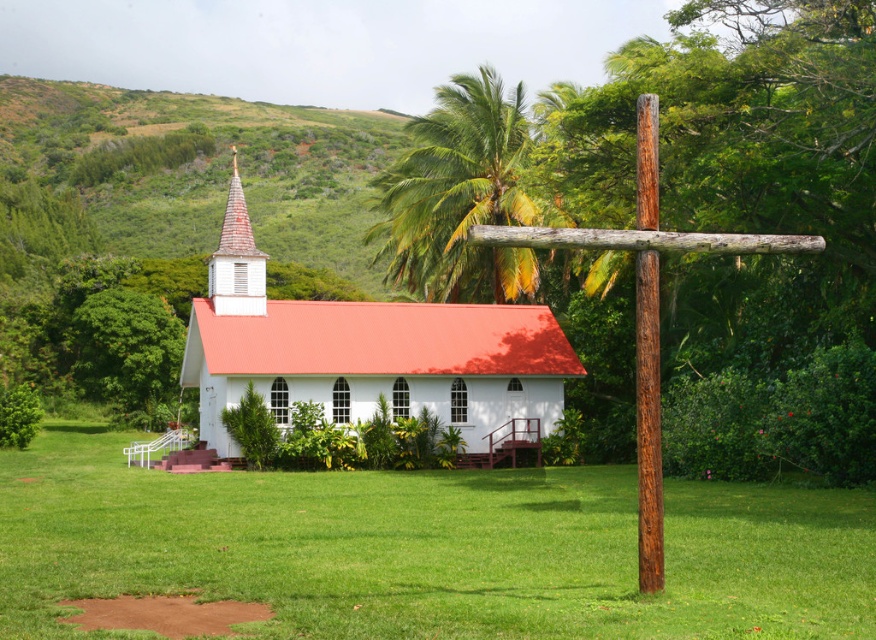
Who is more distant from viewer, (724, 628) or (458, 285)?

The point (458, 285) is more distant.

Is green grass at center above green leafy palm tree at upper center?

Actually, green grass at center is below green leafy palm tree at upper center.

What do you see at coordinates (426, 548) in the screenshot?
I see `green grass at center` at bounding box center [426, 548].

Identify the location of green grass at center. This screenshot has height=640, width=876. (426, 548).

Is green leafy palm tree at upper center smaller than wooden shingles spire at upper left?

Correct, green leafy palm tree at upper center occupies less space than wooden shingles spire at upper left.

Who is more forward, [496,285] or [225,298]?

Point [225,298] is more forward.

Is point (369, 232) positioned before point (235, 253)?

No, it is not.

Locate an element on the screen. This screenshot has width=876, height=640. green leafy palm tree at upper center is located at coordinates (458, 196).

Is the position of green leafy palm tree at upper center more distant than that of brown wooden cross at right?

Yes, green leafy palm tree at upper center is behind brown wooden cross at right.

Is green leafy palm tree at upper center wider than brown wooden cross at right?

No, green leafy palm tree at upper center is not wider than brown wooden cross at right.

Measure the distance between green leafy palm tree at upper center and camera.

54.78 meters

Locate an element on the screen. green leafy palm tree at upper center is located at coordinates (458, 196).